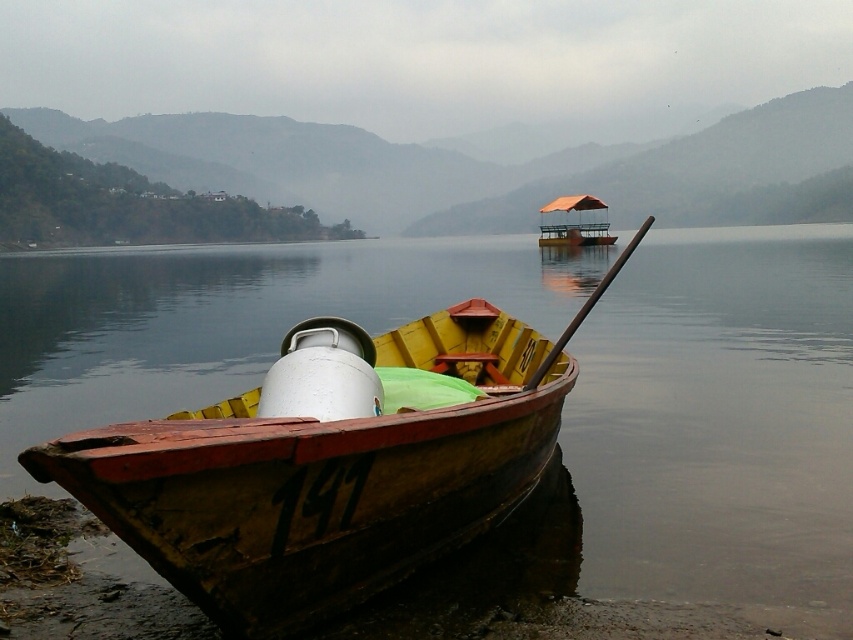
Question: Is wooden boat at lower left to the right of orange canvas boat at center from the viewer's perspective?

Choices:
 (A) no
 (B) yes

Answer: (A)

Question: Which point appears closest to the camera in this image?

Choices:
 (A) (106, 512)
 (B) (564, 240)

Answer: (A)

Question: Does wooden boat at lower left appear over orange canvas boat at center?

Choices:
 (A) no
 (B) yes

Answer: (A)

Question: In this image, where is wooden boat at lower left located relative to orange canvas boat at center?

Choices:
 (A) above
 (B) below

Answer: (B)

Question: Which point appears closest to the camera in this image?

Choices:
 (A) (430, 531)
 (B) (582, 205)

Answer: (A)